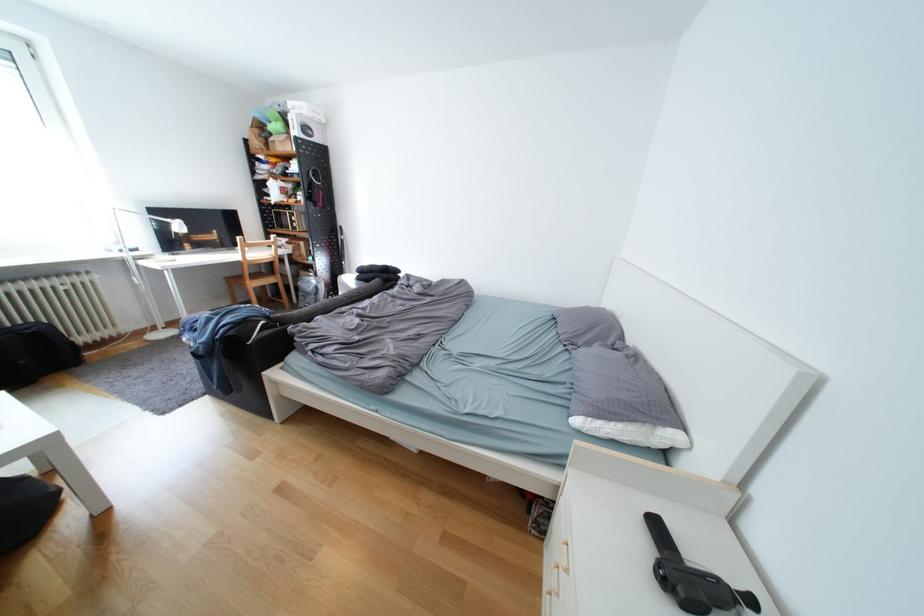
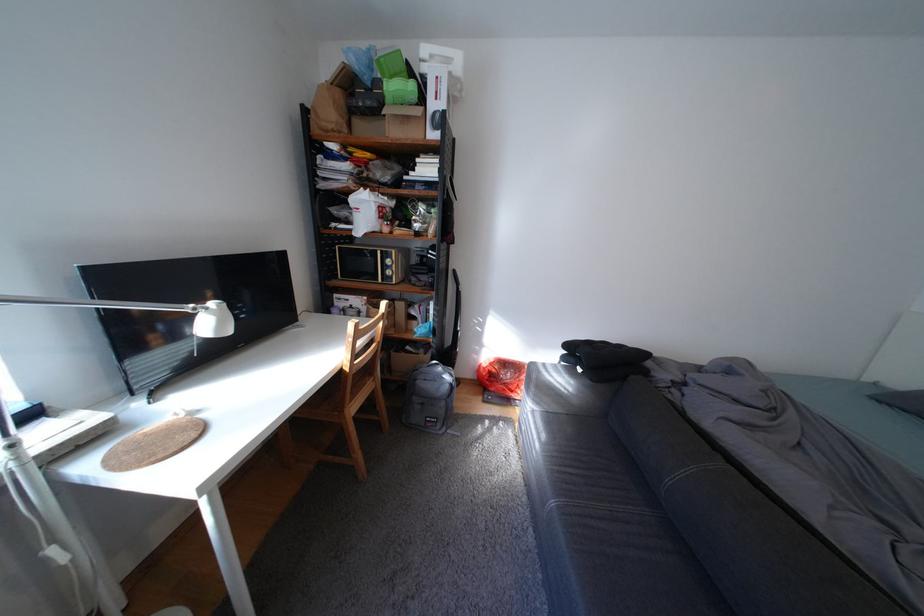
In a continuous first-person perspective shot, in which direction is the camera moving?

The cameraman walked toward left, forward.